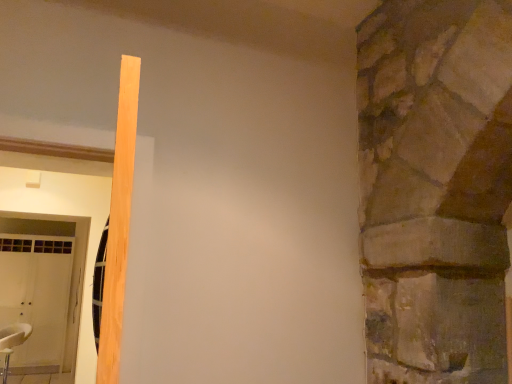
Question: Can you confirm if light wood beam at left is positioned to the left of white leather chair at lower left?

Choices:
 (A) no
 (B) yes

Answer: (A)

Question: Does light wood beam at left lie in front of white leather chair at lower left?

Choices:
 (A) no
 (B) yes

Answer: (B)

Question: Considering the relative sizes of light wood beam at left and white leather chair at lower left in the image provided, is light wood beam at left shorter than white leather chair at lower left?

Choices:
 (A) no
 (B) yes

Answer: (B)

Question: Is light wood beam at left not inside white leather chair at lower left?

Choices:
 (A) no
 (B) yes

Answer: (B)

Question: Is light wood beam at left positioned with its back to white leather chair at lower left?

Choices:
 (A) yes
 (B) no

Answer: (B)

Question: Can you confirm if light wood beam at left is positioned to the right of white leather chair at lower left?

Choices:
 (A) no
 (B) yes

Answer: (B)

Question: Is white leather chair at lower left to the left of light wood beam at left from the viewer's perspective?

Choices:
 (A) yes
 (B) no

Answer: (A)

Question: From a real-world perspective, is white leather chair at lower left on light wood beam at left?

Choices:
 (A) yes
 (B) no

Answer: (B)

Question: Is white leather chair at lower left bigger than light wood beam at left?

Choices:
 (A) no
 (B) yes

Answer: (B)

Question: Is white leather chair at lower left closer to the viewer compared to light wood beam at left?

Choices:
 (A) yes
 (B) no

Answer: (B)

Question: Is white leather chair at lower left further to camera compared to light wood beam at left?

Choices:
 (A) yes
 (B) no

Answer: (A)

Question: From the image's perspective, is white leather chair at lower left located above light wood beam at left?

Choices:
 (A) yes
 (B) no

Answer: (B)

Question: In the image, is light wood beam at left positioned in front of or behind white leather chair at lower left?

Choices:
 (A) behind
 (B) front

Answer: (B)